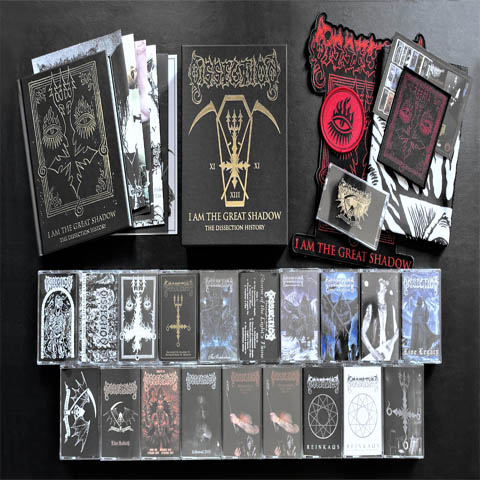
The height and width of the screenshot is (480, 480). In order to click on book in this screenshot , I will do `click(114, 153)`.